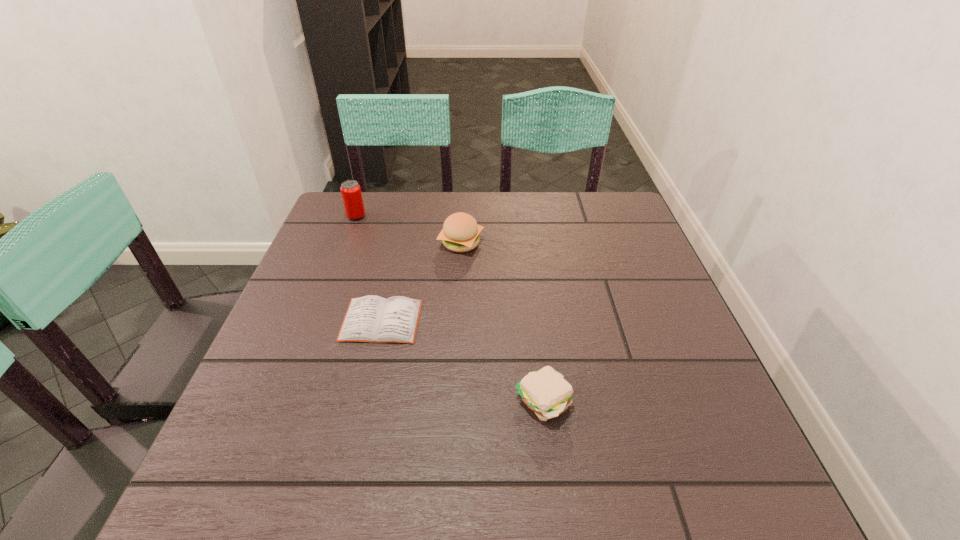
Locate an element on the screen. free space located on the left of the rightmost object is located at coordinates (460, 402).

Locate an element on the screen. Image resolution: width=960 pixels, height=540 pixels. free space located on the right of the shortest object is located at coordinates (544, 320).

In order to click on can that is at the far edge in this screenshot , I will do `click(351, 193)`.

Locate an element on the screen. The width and height of the screenshot is (960, 540). hamburger that is at the far edge is located at coordinates (460, 233).

The image size is (960, 540). In order to click on can at the left edge in this screenshot , I will do `click(351, 193)`.

I want to click on diary that is at the left edge, so click(x=373, y=319).

Identify the location of object that is positioned at the far left corner. Image resolution: width=960 pixels, height=540 pixels. (351, 193).

I want to click on vacant region at the far edge of the desktop, so click(x=396, y=205).

In the image, there is a desktop. Identify the location of vacant space at the near edge. The image size is (960, 540). (620, 494).

I want to click on vacant space at the left edge of the desktop, so (297, 355).